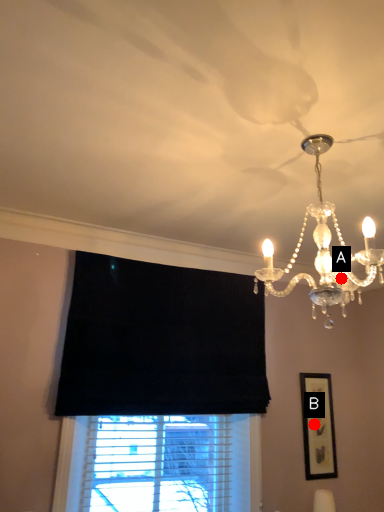
Question: Two points are circled on the image, labeled by A and B beside each circle. Which point appears farthest from the camera in this image?

Choices:
 (A) A is further
 (B) B is further

Answer: (B)